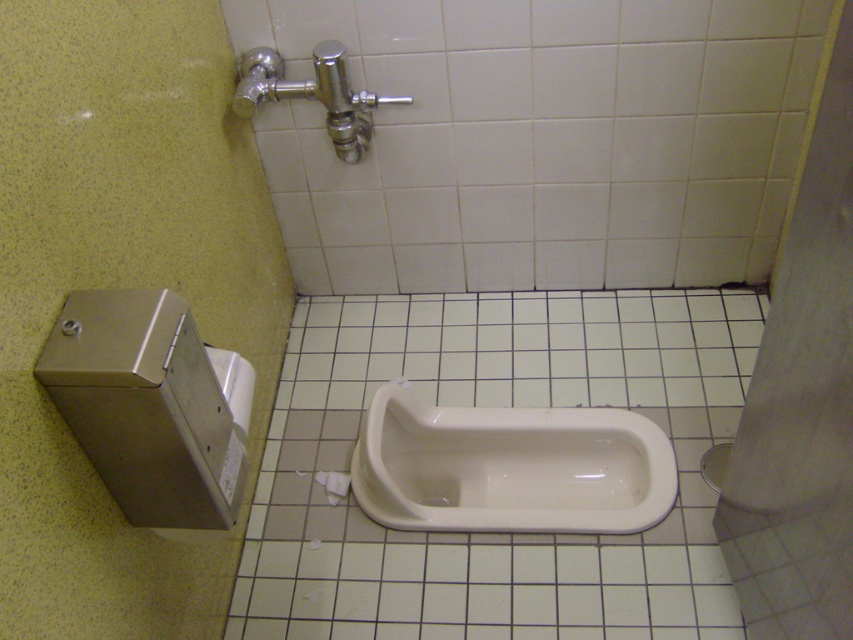
Can you confirm if white glossy urinal at center is positioned below white matte toilet paper at lower center?

Actually, white glossy urinal at center is above white matte toilet paper at lower center.

Who is positioned more to the left, white glossy urinal at center or white matte toilet paper at lower center?

From the viewer's perspective, white matte toilet paper at lower center appears more on the left side.

Between point (383, 436) and point (343, 493), which one is positioned behind?

The point (383, 436) is behind.

You are a GUI agent. You are given a task and a screenshot of the screen. Output one action in this format:
    pyautogui.click(x=<x>, y=<y>)
    Task: Click on the white glossy urinal at center
    The height and width of the screenshot is (640, 853).
    Given the screenshot: What is the action you would take?
    pyautogui.click(x=509, y=467)

Between point (570, 573) and point (425, 419), which one is positioned behind?

The point (425, 419) is more distant.

Measure the distance between white glossy toilet at center and camera.

1.29 meters

Locate an element on the screen. Image resolution: width=853 pixels, height=640 pixels. white glossy toilet at center is located at coordinates (495, 404).

Does white glossy toilet at center have a smaller size compared to white matte toilet paper at lower center?

No, white glossy toilet at center is not smaller than white matte toilet paper at lower center.

Is point (531, 349) farther from viewer compared to point (325, 481)?

That is True.

Does point (761, 310) lie in front of point (328, 490)?

No.

Locate an element on the screen. The image size is (853, 640). white glossy toilet at center is located at coordinates (495, 404).